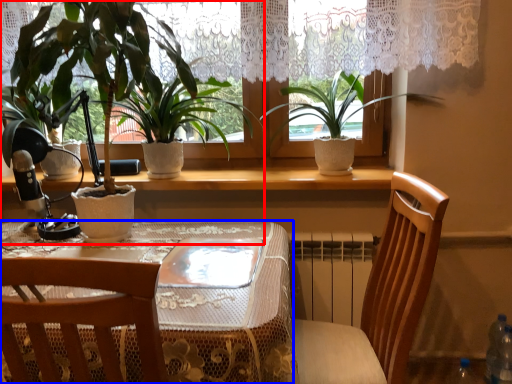
Question: Which object appears closest to the camera in this image, houseplant (highlighted by a red box) or table (highlighted by a blue box)?

Choices:
 (A) houseplant
 (B) table

Answer: (B)